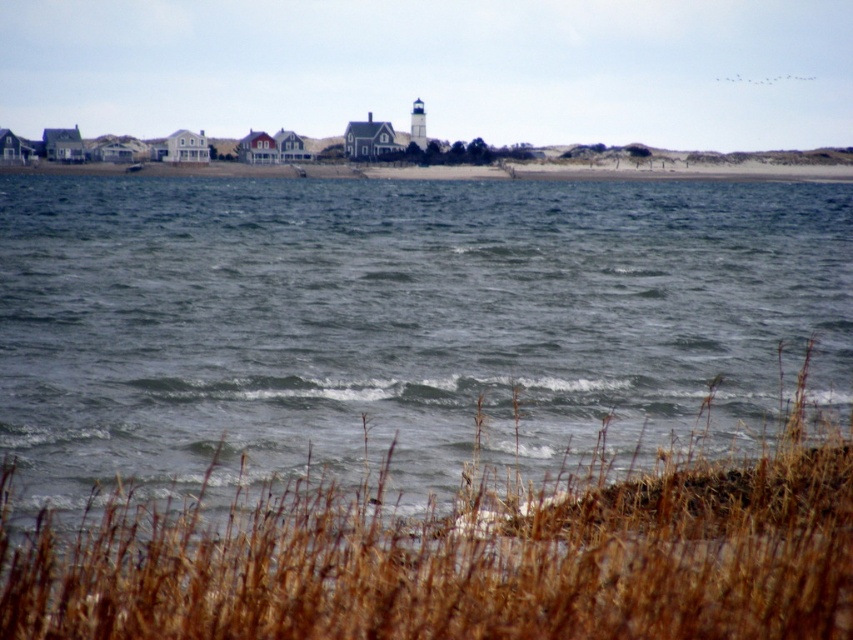
Question: Is gray water at center positioned before brown grass at lower center?

Choices:
 (A) yes
 (B) no

Answer: (B)

Question: Is gray water at center further to the viewer compared to brown grass at lower center?

Choices:
 (A) yes
 (B) no

Answer: (A)

Question: Is gray water at center further to the viewer compared to brown grass at lower center?

Choices:
 (A) no
 (B) yes

Answer: (B)

Question: Which point is closer to the camera taking this photo?

Choices:
 (A) (573, 531)
 (B) (73, 349)

Answer: (A)